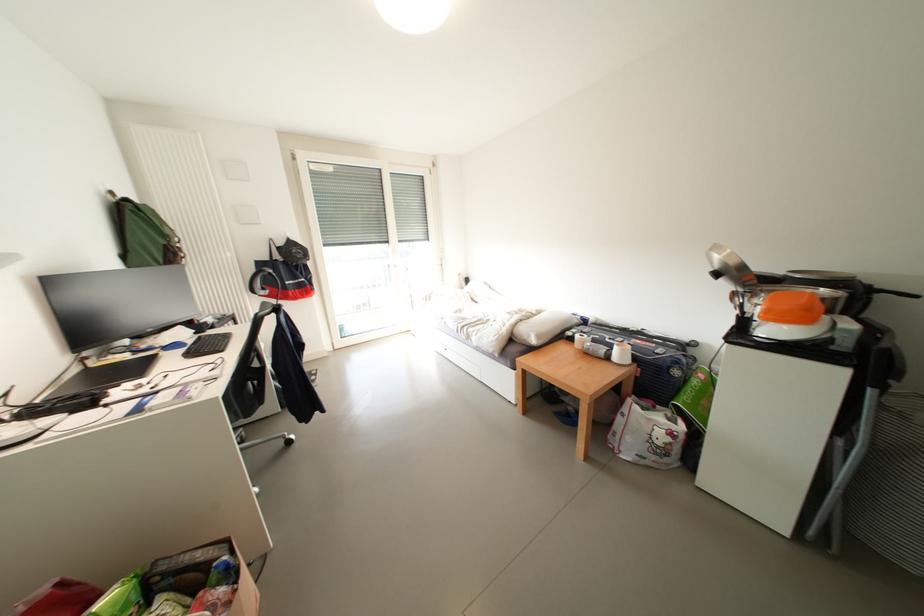
This screenshot has width=924, height=616. What are the coordinates of `silver pot lid handle` in the screenshot? It's located at tap(713, 270).